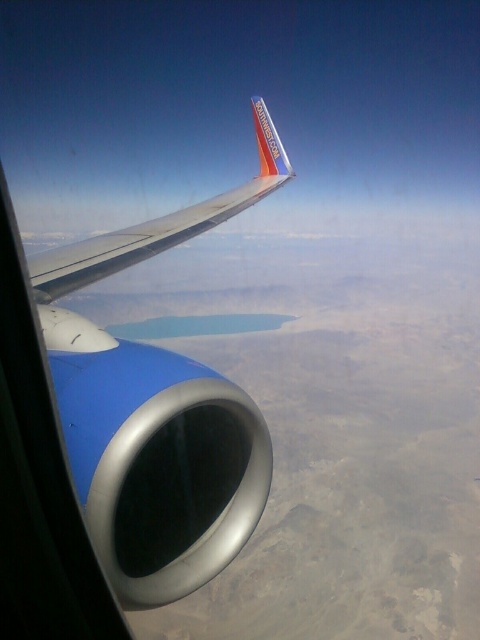
Question: Is metallic blue engine at center above metallic silver wing at center?

Choices:
 (A) no
 (B) yes

Answer: (A)

Question: Does metallic blue engine at center have a larger size compared to metallic silver wing at center?

Choices:
 (A) yes
 (B) no

Answer: (B)

Question: Which point is closer to the camera?

Choices:
 (A) metallic blue engine at center
 (B) metallic silver wing at center

Answer: (A)

Question: Which point is farther to the camera?

Choices:
 (A) metallic silver wing at center
 (B) metallic blue engine at center

Answer: (A)

Question: Does metallic blue engine at center have a lesser width compared to metallic silver wing at center?

Choices:
 (A) no
 (B) yes

Answer: (B)